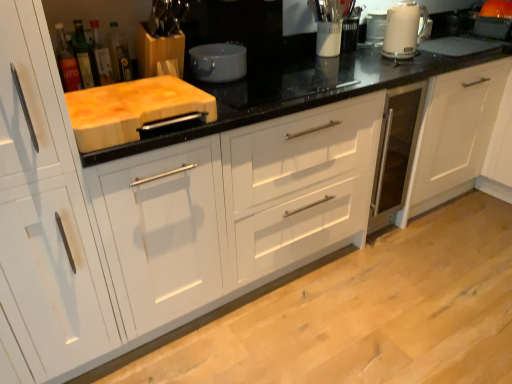
Question: Is matte gray pot at center to the right of white glossy kettle at upper right from the viewer's perspective?

Choices:
 (A) yes
 (B) no

Answer: (B)

Question: From a real-world perspective, is matte gray pot at center under white glossy kettle at upper right?

Choices:
 (A) no
 (B) yes

Answer: (B)

Question: Is matte gray pot at center smaller than white glossy kettle at upper right?

Choices:
 (A) yes
 (B) no

Answer: (B)

Question: Does matte gray pot at center contain white glossy kettle at upper right?

Choices:
 (A) yes
 (B) no

Answer: (B)

Question: Is matte gray pot at center further to the viewer compared to white glossy kettle at upper right?

Choices:
 (A) yes
 (B) no

Answer: (B)

Question: Does matte gray pot at center have a greater width compared to white glossy kettle at upper right?

Choices:
 (A) no
 (B) yes

Answer: (B)

Question: From a real-world perspective, is translucent glass bottle at upper left, arranged as the first bottle when viewed from the right, on top of translucent glass bottle at upper left, which appears as the second bottle when viewed from the right?

Choices:
 (A) no
 (B) yes

Answer: (A)

Question: Is translucent glass bottle at upper left, placed as the fourth bottle when sorted from left to right, positioned with its back to translucent glass bottle at upper left, the third bottle in the left-to-right sequence?

Choices:
 (A) yes
 (B) no

Answer: (B)

Question: Is translucent glass bottle at upper left, arranged as the first bottle when viewed from the right, facing towards translucent glass bottle at upper left, the third bottle in the left-to-right sequence?

Choices:
 (A) no
 (B) yes

Answer: (A)

Question: Does translucent glass bottle at upper left, arranged as the first bottle when viewed from the right, have a larger size compared to translucent glass bottle at upper left, the third bottle in the left-to-right sequence?

Choices:
 (A) yes
 (B) no

Answer: (B)

Question: From the image's perspective, is translucent glass bottle at upper left, placed as the fourth bottle when sorted from left to right, beneath translucent glass bottle at upper left, which appears as the second bottle when viewed from the right?

Choices:
 (A) no
 (B) yes

Answer: (A)

Question: Is translucent glass bottle at upper left, arranged as the first bottle when viewed from the right, far away from translucent glass bottle at upper left, which appears as the second bottle when viewed from the right?

Choices:
 (A) yes
 (B) no

Answer: (B)

Question: Is translucent glass bottle at upper left, which is the first bottle in left-to-right order, thinner than green glass bottle at upper left, placed as the 2th bottle when sorted from left to right?

Choices:
 (A) no
 (B) yes

Answer: (B)